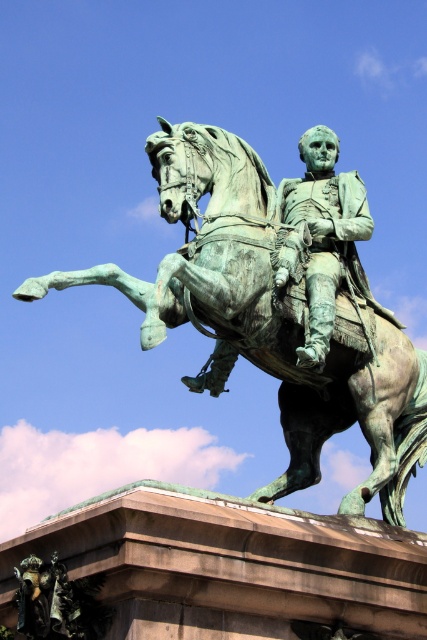
Looking at this image, can you confirm if green patina horse at center is taller than green patina statue at center?

Yes.

The height and width of the screenshot is (640, 427). What do you see at coordinates (266, 317) in the screenshot?
I see `green patina horse at center` at bounding box center [266, 317].

Identify the location of green patina horse at center. The image size is (427, 640). (266, 317).